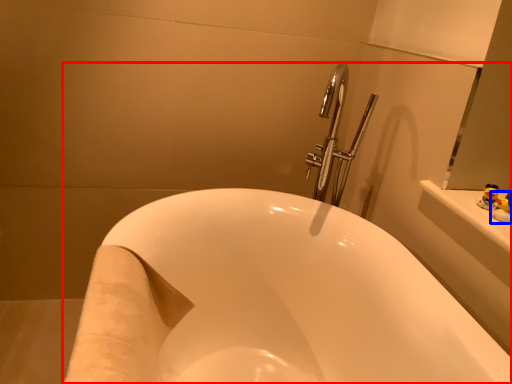
Question: Which point is closer to the camera, bathtub (highlighted by a red box) or toy (highlighted by a blue box)?

Choices:
 (A) bathtub
 (B) toy

Answer: (A)